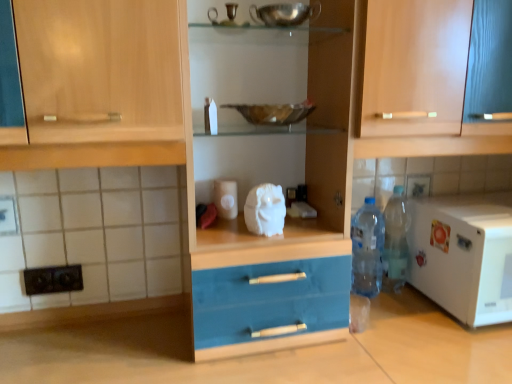
Question: From a real-world perspective, relative to white matte microwave at right, is white glossy tile at upper center vertically above or below?

Choices:
 (A) below
 (B) above

Answer: (B)

Question: Is white glossy tile at upper center wider or thinner than white matte microwave at right?

Choices:
 (A) thin
 (B) wide

Answer: (A)

Question: Which object is positioned closest to the translucent plastic bottle at lower right, the 2th bottle viewed from the left?

Choices:
 (A) wooden cabinet at upper center
 (B) white glossy tile at upper center
 (C) translucent plastic bottle at lower right, the first bottle from the left
 (D) metallic reflective bowl at center
 (E) white matte microwave at right

Answer: (C)

Question: Considering the real-world distances, which object is farthest from the white matte microwave at right?

Choices:
 (A) wooden cabinet at upper center
 (B) matte wood cabinet at center
 (C) metallic reflective bowl at center
 (D) translucent plastic bottle at lower right, the first bottle from the left
 (E) translucent plastic bottle at lower right, the 2th bottle viewed from the left

Answer: (C)